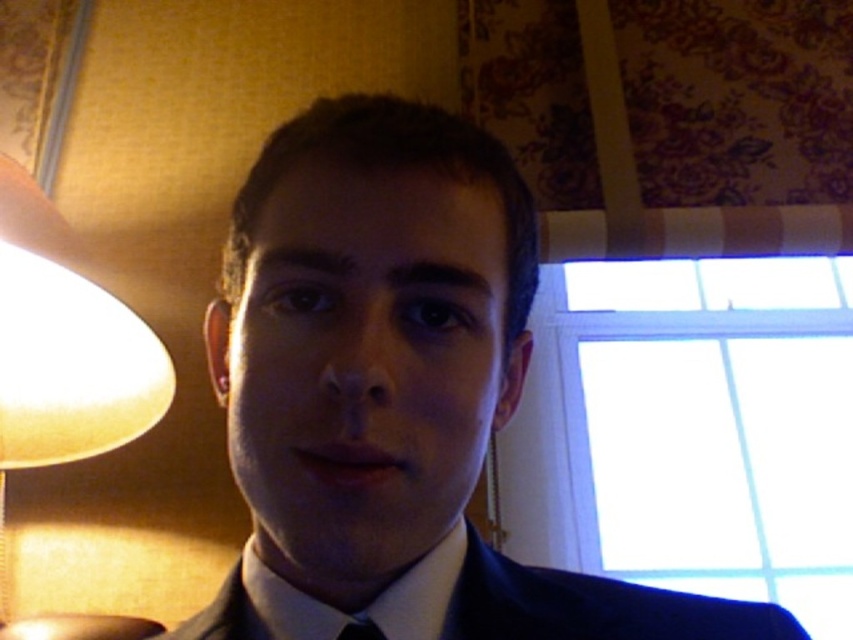
Question: Which point is closer to the camera taking this photo?

Choices:
 (A) (611, 634)
 (B) (82, 435)
 (C) (379, 636)

Answer: (C)

Question: Which of these objects is positioned farthest from the navy blue fabric business suit at center?

Choices:
 (A) matte beige lampshade at left
 (B) black satin tie at lower center

Answer: (A)

Question: Can you confirm if matte black suit at center is positioned to the right of matte beige lampshade at left?

Choices:
 (A) no
 (B) yes

Answer: (B)

Question: Estimate the real-world distances between objects in this image. Which object is closer to the black satin tie at lower center?

Choices:
 (A) matte beige lampshade at left
 (B) navy blue fabric business suit at center

Answer: (B)

Question: Is matte beige lampshade at left closer to camera compared to black satin tie at lower center?

Choices:
 (A) no
 (B) yes

Answer: (A)

Question: Can you confirm if matte black suit at center is positioned to the right of matte beige lampshade at left?

Choices:
 (A) yes
 (B) no

Answer: (A)